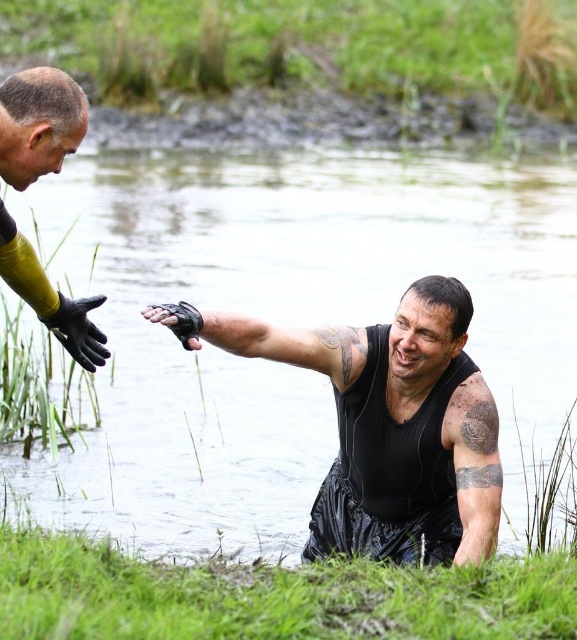
Based on the photo, you are a lifeguard standing at the edge of the water. You see the clear water at center. Where exactly is the clear water located in the image?

The clear water at center is located at point 0.505 on the x axis and 0.497 on the y axis.

You are standing at the origin point in the image. Which object is closest to the point labeled as point (39, 124)?

The yellow rubber glove at left is located at point (39, 124), so it is the closest object to that point.

You are a photographer standing at the camera position. You need to capture a closeup shot of the yellow rubber glove at left. Is the glove within your camera lens range if the maximum focus distance is 10 feet?

The yellow rubber glove at left is 12.87 feet away from the camera. Since the maximum focus distance is 10 feet, the glove is out of range and cannot be captured in focus.